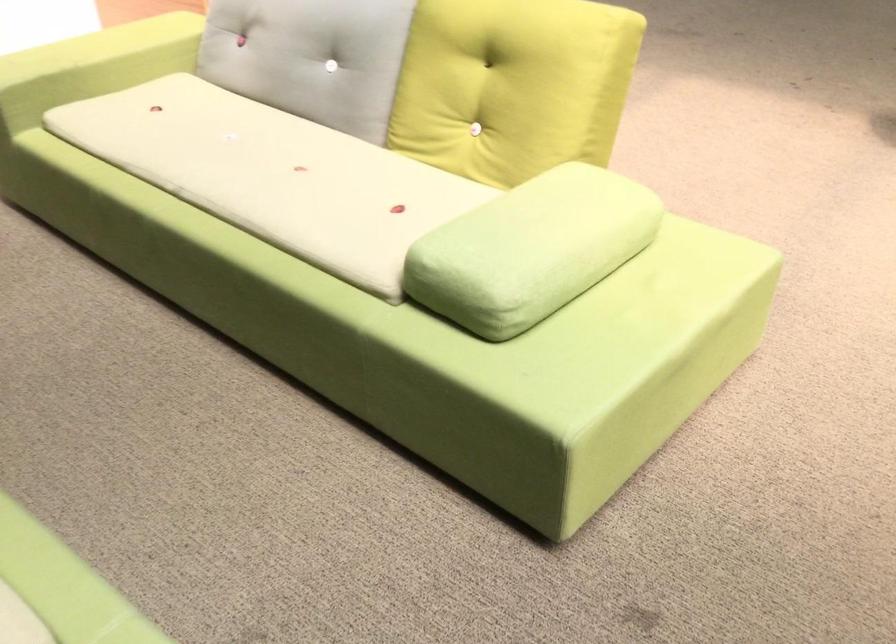
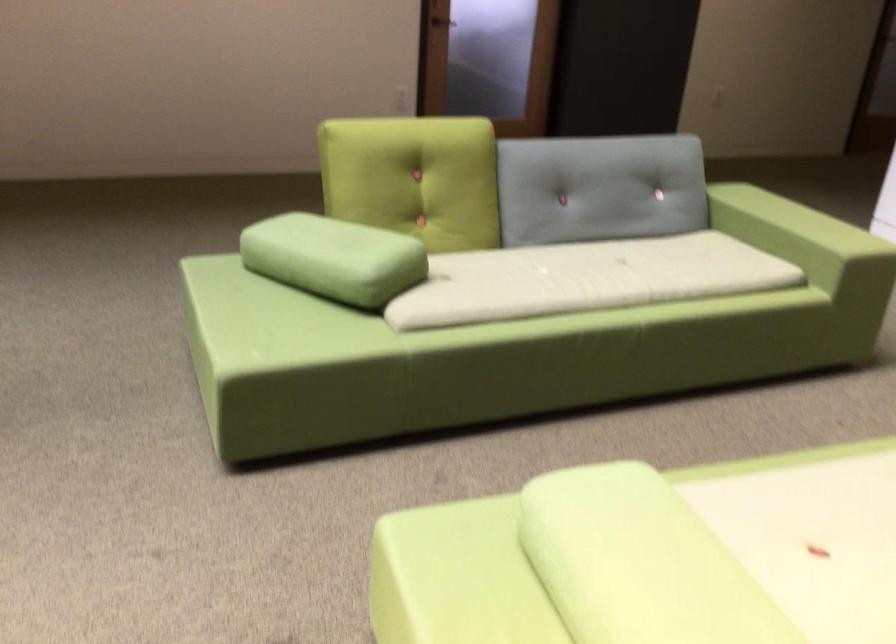
Find the pixel in the second image that matches point (541, 214) in the first image.

(651, 556)